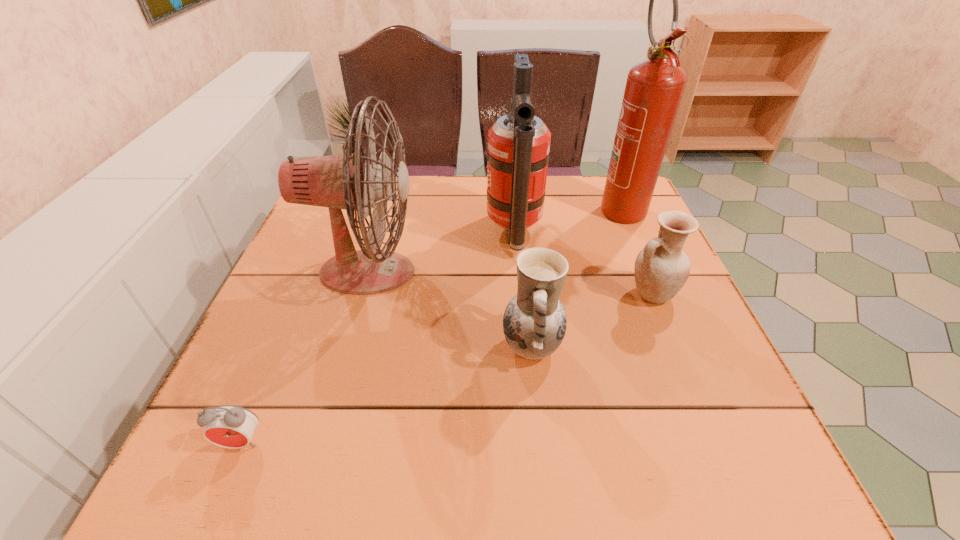
I want to click on vacant space that satisfies the following two spatial constraints: 1. in front of the right pottery to direct airflow; 2. on the left side of the fan, so click(x=361, y=294).

The height and width of the screenshot is (540, 960). I want to click on vacant space that satisfies the following two spatial constraints: 1. on the front label side of the shorter fire extinguisher; 2. on the face of the alarm clock, so click(534, 442).

At what (x,y) coordinates should I click in order to perform the action: click on free location that satisfies the following two spatial constraints: 1. from the nozzle of the right fire extinguisher; 2. in front of the fan to direct airflow. Please return your answer as a coordinate pair (x, y). Image resolution: width=960 pixels, height=540 pixels. Looking at the image, I should click on (649, 273).